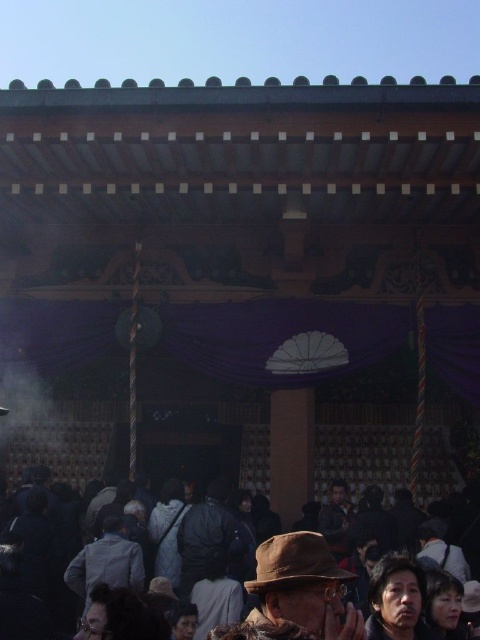
Question: Does dark brown fabric crowd at lower center have a greater width compared to gray fabric jacket at lower left?

Choices:
 (A) yes
 (B) no

Answer: (A)

Question: In this image, where is brown fabric hat at lower center located relative to dark gray fabric jacket at center?

Choices:
 (A) below
 (B) above

Answer: (A)

Question: Which of the following is the farthest from the observer?

Choices:
 (A) (380, 637)
 (B) (320, 573)
 (C) (252, 620)
 (D) (204, 513)

Answer: (D)

Question: Which object appears farthest from the camera in this image?

Choices:
 (A) dark brown leather hat at lower center
 (B) gray fabric jacket at lower left

Answer: (B)

Question: From the image, what is the correct spatial relationship of brown fabric hat at lower center in relation to gray fabric jacket at lower left?

Choices:
 (A) below
 (B) above

Answer: (B)

Question: Which point is closer to the camera taking this photo?

Choices:
 (A) (324, 612)
 (B) (225, 522)
 (C) (377, 605)

Answer: (A)